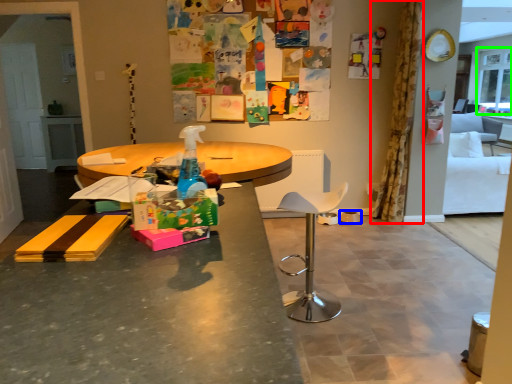
Question: Estimate the real-world distances between objects in this image. Which object is closer to curtain (highlighted by a red box), bowl (highlighted by a blue box) or window screen (highlighted by a green box)?

Choices:
 (A) bowl
 (B) window screen

Answer: (A)